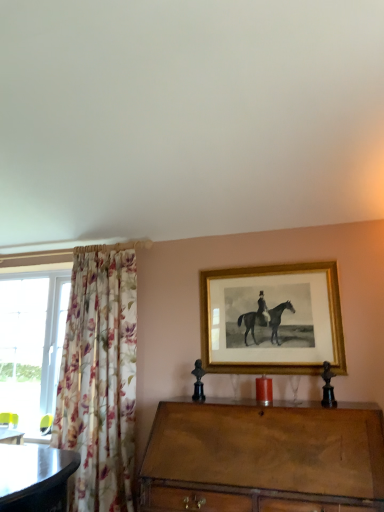
Question: Is brown wooden desk at lower left aimed at floral fabric curtain at left?

Choices:
 (A) no
 (B) yes

Answer: (A)

Question: From a real-world perspective, is brown wooden desk at lower left below floral fabric curtain at left?

Choices:
 (A) no
 (B) yes

Answer: (B)

Question: Does brown wooden desk at lower left have a smaller size compared to floral fabric curtain at left?

Choices:
 (A) yes
 (B) no

Answer: (A)

Question: Does brown wooden desk at lower left have a greater width compared to floral fabric curtain at left?

Choices:
 (A) no
 (B) yes

Answer: (A)

Question: Considering the relative positions of brown wooden desk at lower left and floral fabric curtain at left in the image provided, is brown wooden desk at lower left to the left of floral fabric curtain at left from the viewer's perspective?

Choices:
 (A) no
 (B) yes

Answer: (B)

Question: Would you say gold/gilded picture frame at upper center is to the left or to the right of floral fabric curtain at left in the picture?

Choices:
 (A) right
 (B) left

Answer: (A)

Question: Looking at their shapes, would you say gold/gilded picture frame at upper center is wider or thinner than floral fabric curtain at left?

Choices:
 (A) thin
 (B) wide

Answer: (A)

Question: Does point (306, 368) appear closer or farther from the camera than point (82, 387)?

Choices:
 (A) closer
 (B) farther

Answer: (A)

Question: Relative to floral fabric curtain at left, is gold/gilded picture frame at upper center in front or behind?

Choices:
 (A) front
 (B) behind

Answer: (B)

Question: Is gold/gilded picture frame at upper center bigger or smaller than wooden chest of drawers at center?

Choices:
 (A) small
 (B) big

Answer: (A)

Question: Looking at their shapes, would you say gold/gilded picture frame at upper center is wider or thinner than wooden chest of drawers at center?

Choices:
 (A) wide
 (B) thin

Answer: (B)

Question: From a real-world perspective, is gold/gilded picture frame at upper center physically located above or below wooden chest of drawers at center?

Choices:
 (A) below
 (B) above

Answer: (B)

Question: From their relative heights in the image, would you say gold/gilded picture frame at upper center is taller or shorter than wooden chest of drawers at center?

Choices:
 (A) short
 (B) tall

Answer: (A)

Question: In terms of size, does floral fabric curtain at left appear bigger or smaller than brown wooden desk at lower left?

Choices:
 (A) big
 (B) small

Answer: (A)

Question: Is floral fabric curtain at left in front of or behind brown wooden desk at lower left in the image?

Choices:
 (A) front
 (B) behind

Answer: (A)